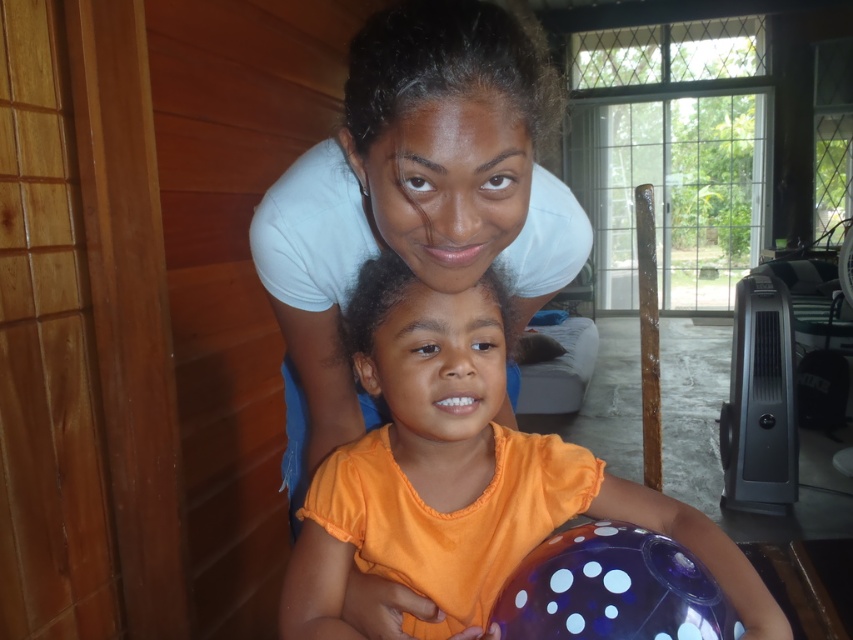
You are a photographer trying to capture a photo of the orange matte shirt at center and the translucent purple beach ball at lower center. If you want to ensure both objects are fully visible in your shot, which object requires more horizontal space in the frame?

The orange matte shirt at center requires more horizontal space in the frame because its width surpasses that of the translucent purple beach ball at lower center.